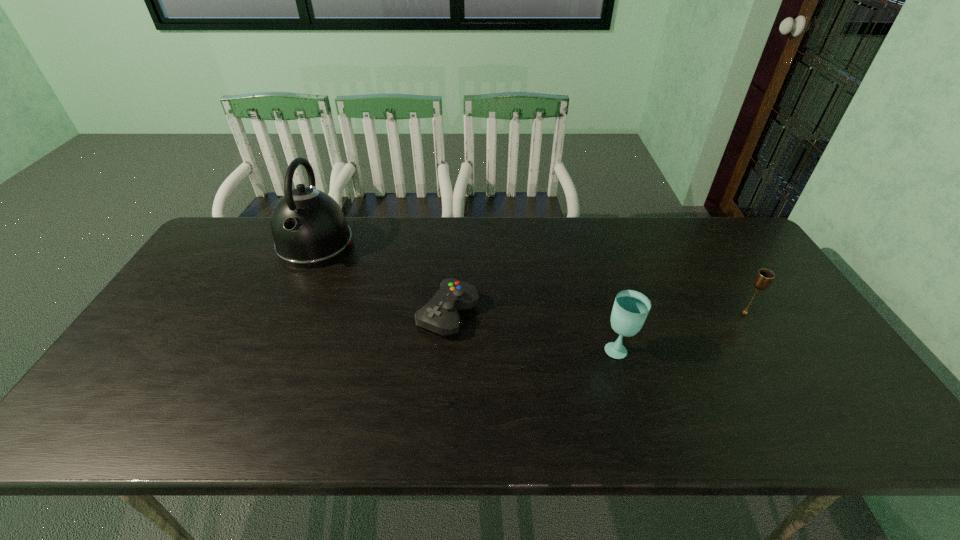
Find the location of `free space that satisfies the following two spatial constraints: 1. on the spout of the second object from right to left; 2. on the left side of the leftmost object`. free space that satisfies the following two spatial constraints: 1. on the spout of the second object from right to left; 2. on the left side of the leftmost object is located at coordinates (269, 349).

I want to click on free point that satisfies the following two spatial constraints: 1. on the spout of the second object from right to left; 2. on the right side of the tallest object, so click(269, 349).

In order to click on free point that satisfies the following two spatial constraints: 1. on the spout of the leftmost object; 2. on the right side of the glass in this screenshot , I will do coord(269,349).

The image size is (960, 540). I want to click on blank area in the image that satisfies the following two spatial constraints: 1. on the spout of the leftmost object; 2. on the left side of the glass, so pos(269,349).

Locate an element on the screen. The width and height of the screenshot is (960, 540). free point that satisfies the following two spatial constraints: 1. on the back side of the glass; 2. on the right side of the chalice is located at coordinates (608, 313).

Locate an element on the screen. The height and width of the screenshot is (540, 960). free point that satisfies the following two spatial constraints: 1. on the spout of the tallest object; 2. on the right side of the glass is located at coordinates (269, 349).

Find the location of a particular element. free point that satisfies the following two spatial constraints: 1. on the back side of the rightmost object; 2. on the left side of the third shortest object is located at coordinates (608, 313).

At what (x,y) coordinates should I click in order to perform the action: click on vacant region that satisfies the following two spatial constraints: 1. on the back side of the shortest object; 2. on the left side of the chalice. Please return your answer as a coordinate pair (x, y). The height and width of the screenshot is (540, 960). Looking at the image, I should click on (448, 313).